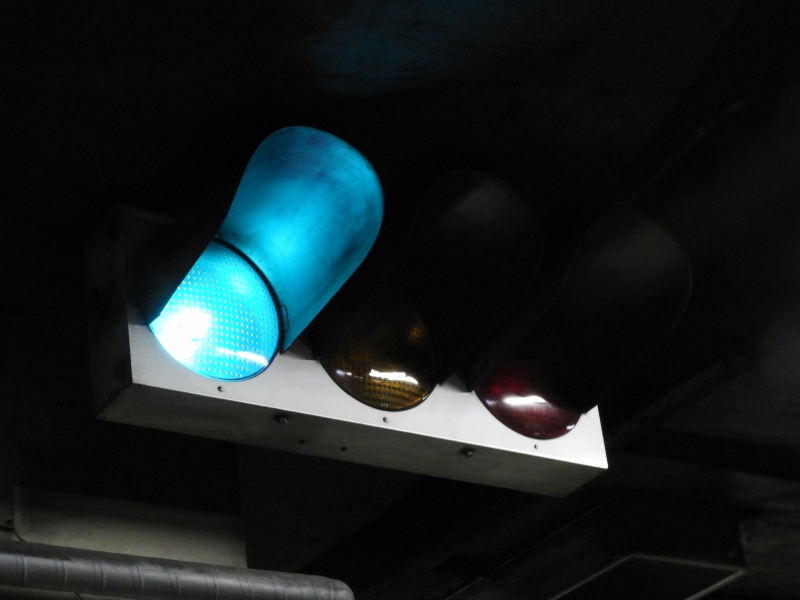
Identify the location of ceiling. (753, 401).